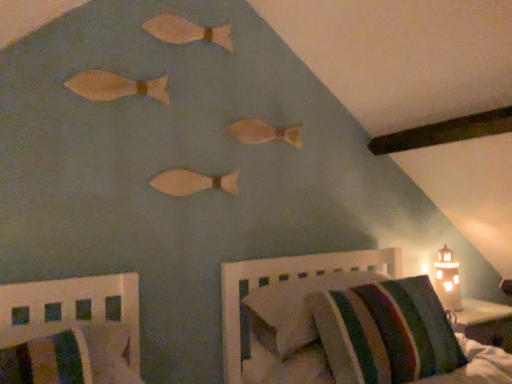
Question: In which direction should I rotate to look at matte wooden fish at center, which appears as the first animal when ordered from the bottom?

Choices:
 (A) right
 (B) left

Answer: (B)

Question: Is wooden fish at center, the 2th animal ordered from the bottom, positioned far away from wooden fish at upper center, positioned as the fourth animal in bottom-to-top order?

Choices:
 (A) no
 (B) yes

Answer: (A)

Question: Is wooden fish at center, which is the third animal from top to bottom, bigger than wooden fish at upper center, placed as the 1th animal when sorted from top to bottom?

Choices:
 (A) no
 (B) yes

Answer: (B)

Question: Does wooden fish at center, the 2th animal ordered from the bottom, have a lesser width compared to wooden fish at upper center, placed as the 1th animal when sorted from top to bottom?

Choices:
 (A) no
 (B) yes

Answer: (A)

Question: Are wooden fish at center, the 2th animal ordered from the bottom, and wooden fish at upper center, positioned as the fourth animal in bottom-to-top order, making contact?

Choices:
 (A) yes
 (B) no

Answer: (B)

Question: Could you tell me if wooden fish at center, the 2th animal ordered from the bottom, is turned towards wooden fish at upper center, positioned as the fourth animal in bottom-to-top order?

Choices:
 (A) yes
 (B) no

Answer: (B)

Question: Is wooden fish at center, which is the third animal from top to bottom, not inside wooden fish at upper center, positioned as the fourth animal in bottom-to-top order?

Choices:
 (A) yes
 (B) no

Answer: (A)

Question: Does striped fabric chair at lower left, which ranks as the 1th furniture in left-to-right order, have a smaller size compared to wooden fish at upper center, placed as the 1th animal when sorted from top to bottom?

Choices:
 (A) no
 (B) yes

Answer: (A)

Question: Is striped fabric chair at lower left, which ranks as the 1th furniture in left-to-right order, further to the viewer compared to wooden fish at upper center, placed as the 1th animal when sorted from top to bottom?

Choices:
 (A) yes
 (B) no

Answer: (B)

Question: Considering the relative sizes of striped fabric chair at lower left, which ranks as the 1th furniture in left-to-right order, and wooden fish at upper center, positioned as the fourth animal in bottom-to-top order, in the image provided, is striped fabric chair at lower left, which ranks as the 1th furniture in left-to-right order, bigger than wooden fish at upper center, positioned as the fourth animal in bottom-to-top order,?

Choices:
 (A) yes
 (B) no

Answer: (A)

Question: Is striped fabric chair at lower left, arranged as the 2th furniture when viewed from the right, next to wooden fish at upper center, positioned as the fourth animal in bottom-to-top order, and touching it?

Choices:
 (A) yes
 (B) no

Answer: (B)

Question: From the image's perspective, is striped fabric chair at lower left, arranged as the 2th furniture when viewed from the right, over wooden fish at upper center, positioned as the fourth animal in bottom-to-top order?

Choices:
 (A) no
 (B) yes

Answer: (A)

Question: Is striped fabric chair at lower left, which ranks as the 1th furniture in left-to-right order, oriented towards wooden fish at upper center, placed as the 1th animal when sorted from top to bottom?

Choices:
 (A) no
 (B) yes

Answer: (A)

Question: Considering the relative sizes of striped fabric pillow at lower right and striped fabric mattress at lower right in the image provided, is striped fabric pillow at lower right thinner than striped fabric mattress at lower right?

Choices:
 (A) yes
 (B) no

Answer: (B)